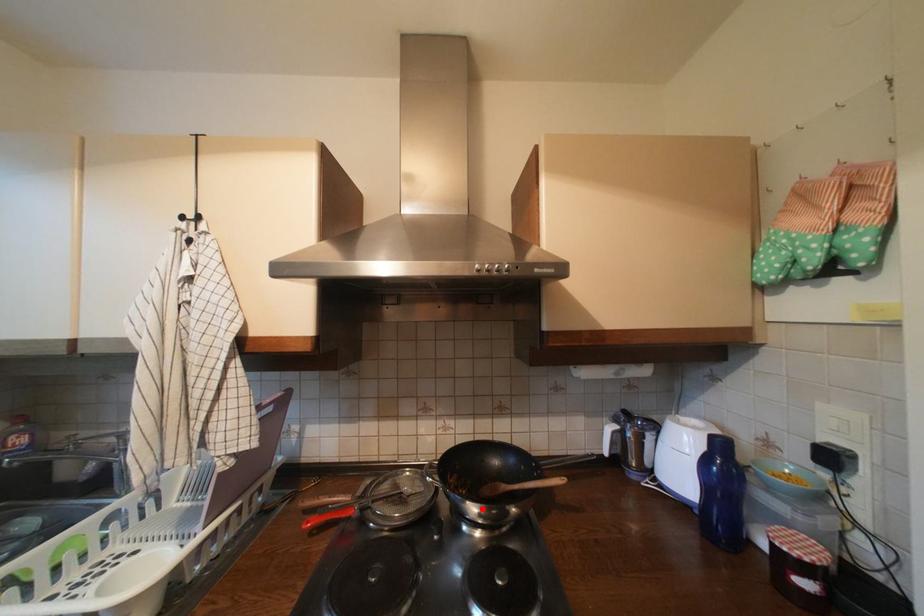
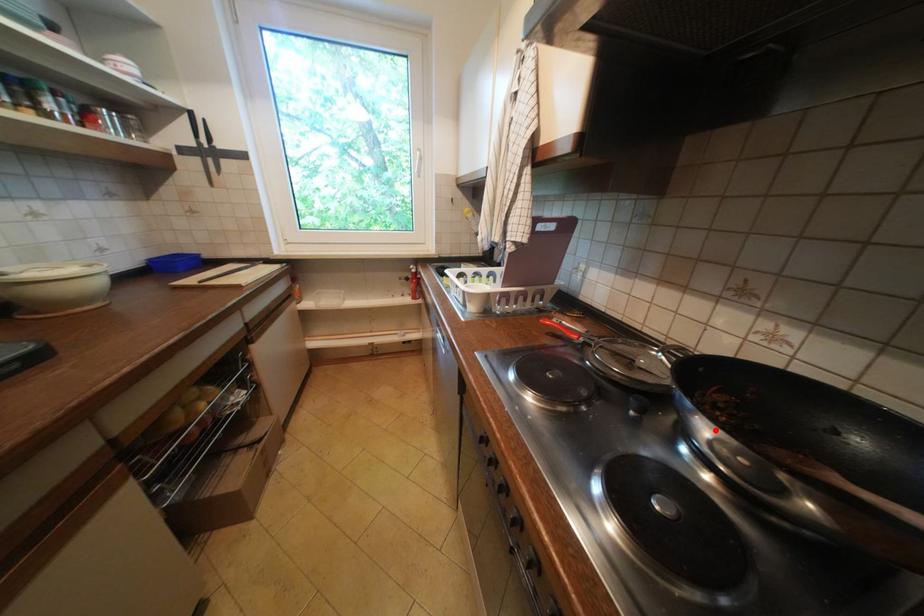
I am providing you with two images of the same scene from different viewpoints. A red point is marked on the first image and another point is marked on the second image. Are the points marked in image1 and image2 representing the same 3D position?

Yes